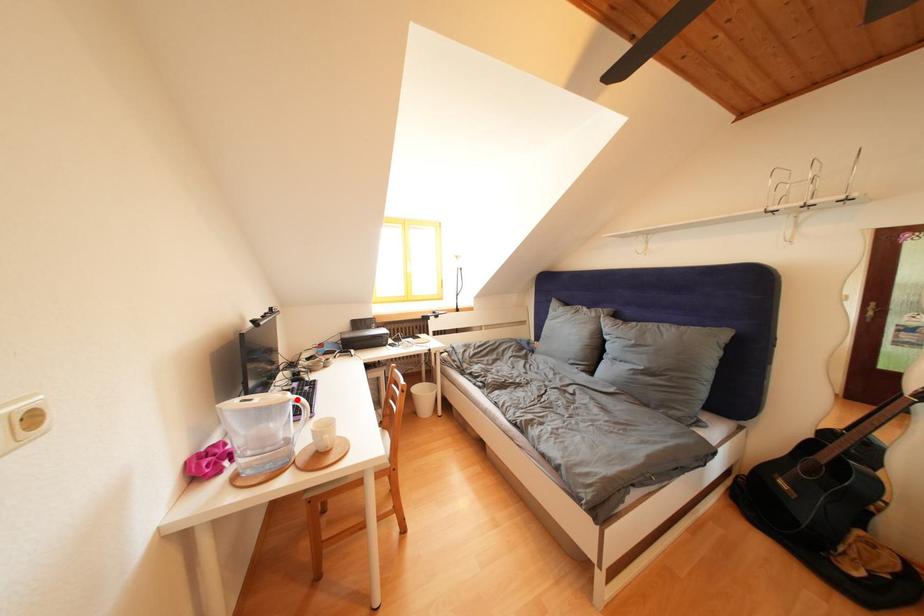
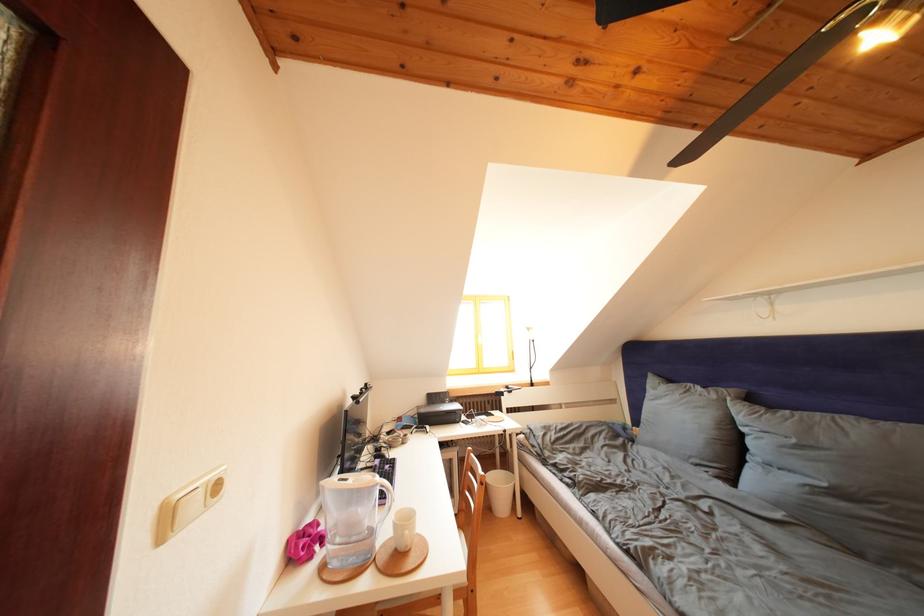
Find the pixel in the second image that matches the highlighted location in the first image.

(385, 482)